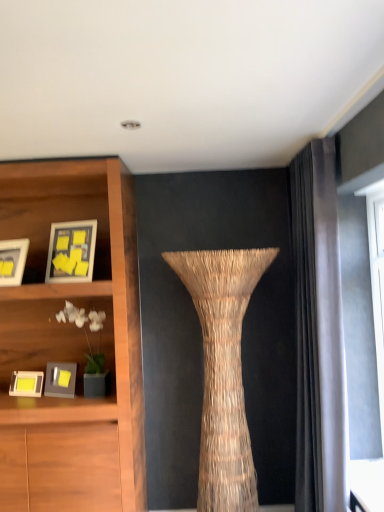
Question: From the image's perspective, relative to matte yellow picture frame at left, the 1th picture frame ordered from the bottom, is matte wooden picture frame at upper left, positioned as the first picture frame in top-to-bottom order, above or below?

Choices:
 (A) above
 (B) below

Answer: (A)

Question: Which is correct: matte wooden picture frame at upper left, marked as the 4th picture frame in a bottom-to-top arrangement, is inside matte yellow picture frame at left, positioned as the fourth picture frame in top-to-bottom order, or outside of it?

Choices:
 (A) outside
 (B) inside

Answer: (A)

Question: Which object is positioned farthest from the natural fiber vase at center?

Choices:
 (A) matte gray shelf at left
 (B) matte yellow picture frame at left, the 1th picture frame ordered from the bottom
 (C) matte white picture frame at left, placed as the second picture frame when sorted from top to bottom
 (D) matte wooden picture frame at upper left, marked as the 4th picture frame in a bottom-to-top arrangement
 (E) matte gray picture frame at lower left, the 2th picture frame when ordered from bottom to top

Answer: (C)

Question: Estimate the real-world distances between objects in this image. Which object is farther from the matte wooden picture frame at upper left, positioned as the first picture frame in top-to-bottom order?

Choices:
 (A) matte yellow picture frame at left, positioned as the fourth picture frame in top-to-bottom order
 (B) matte gray picture frame at lower left, arranged as the third picture frame when viewed from the top
 (C) matte gray shelf at left
 (D) natural fiber vase at center
 (E) matte white picture frame at left, which ranks as the third picture frame in bottom-to-top order

Answer: (A)